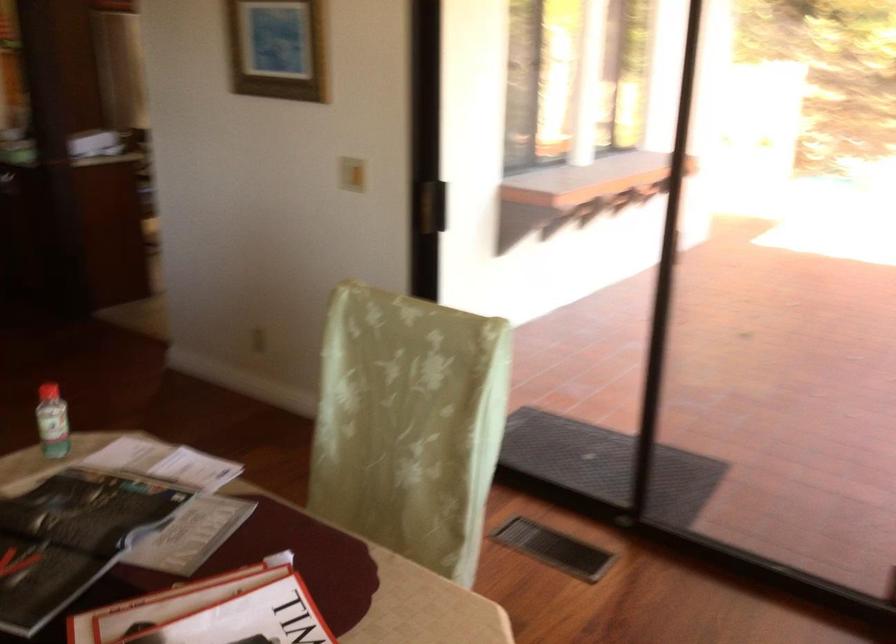
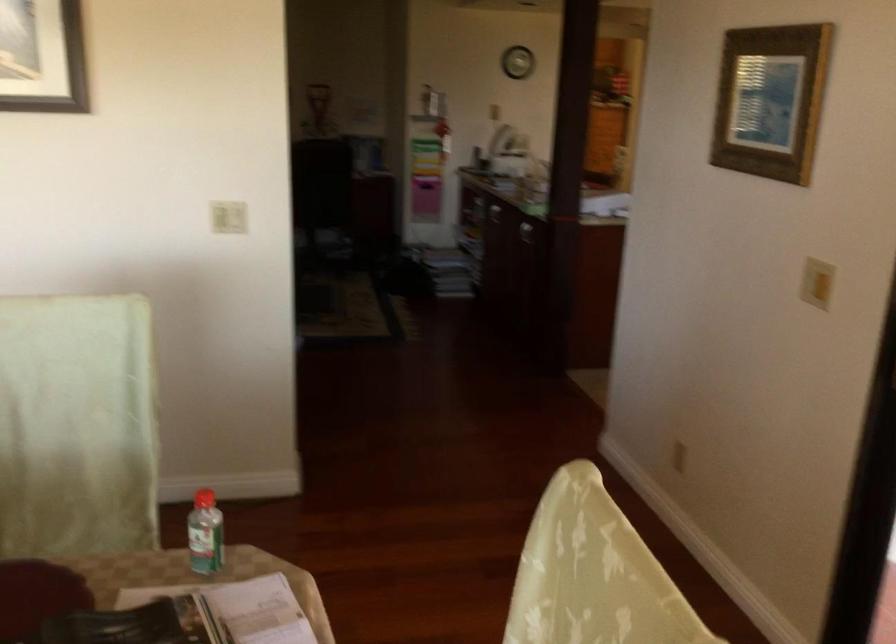
Question: How did the camera likely rotate?

Choices:
 (A) Left
 (B) Right
 (C) Up
 (D) Down

Answer: (A)